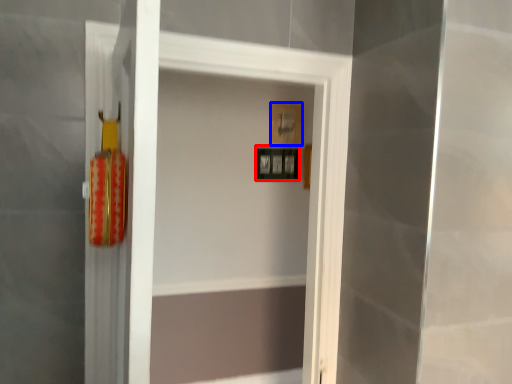
Question: Which of the following is the farthest to the observer, picture frame (highlighted by a red box) or picture frame (highlighted by a blue box)?

Choices:
 (A) picture frame
 (B) picture frame

Answer: (B)